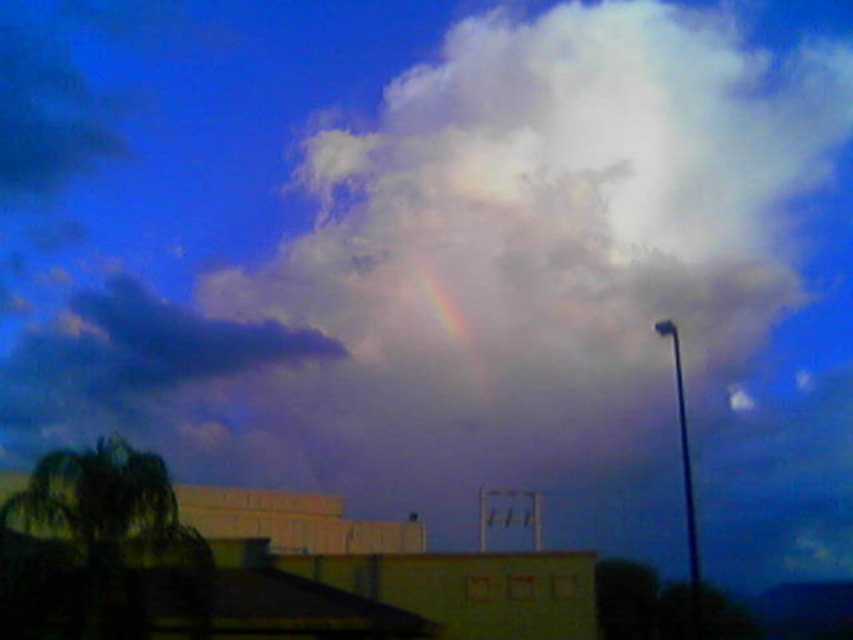
Can you confirm if green leafy palm tree at lower left is positioned below rainbow at upper center?

Indeed, green leafy palm tree at lower left is positioned under rainbow at upper center.

Between green leafy palm tree at lower left and rainbow at upper center, which one has less height?

green leafy palm tree at lower left

The image size is (853, 640). What are the coordinates of `green leafy palm tree at lower left` in the screenshot? It's located at (109, 538).